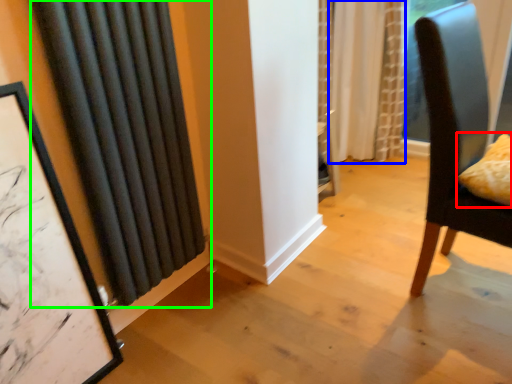
Question: Considering the real-world distances, which object is closest to pillow (highlighted by a red box)? curtain (highlighted by a blue box) or curtain (highlighted by a green box).

Choices:
 (A) curtain
 (B) curtain

Answer: (B)